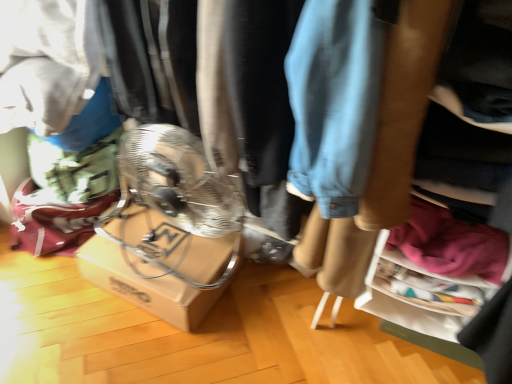
Question: Relative to brown cardboard box at center, is pink fabric at lower right in front or behind?

Choices:
 (A) behind
 (B) front

Answer: (B)

Question: Is pink fabric at lower right wider or thinner than brown cardboard box at center?

Choices:
 (A) thin
 (B) wide

Answer: (A)

Question: Considering the positions of pink fabric at lower right and brown cardboard box at center in the image, is pink fabric at lower right bigger or smaller than brown cardboard box at center?

Choices:
 (A) big
 (B) small

Answer: (B)

Question: Do you think brown cardboard box at center is within pink fabric at lower right, or outside of it?

Choices:
 (A) inside
 (B) outside

Answer: (B)

Question: Is brown cardboard box at center taller or shorter than pink fabric at lower right?

Choices:
 (A) short
 (B) tall

Answer: (A)

Question: From a real-world perspective, is brown cardboard box at center above or below pink fabric at lower right?

Choices:
 (A) below
 (B) above

Answer: (A)

Question: Looking at the image, does brown cardboard box at center seem bigger or smaller compared to pink fabric at lower right?

Choices:
 (A) big
 (B) small

Answer: (A)